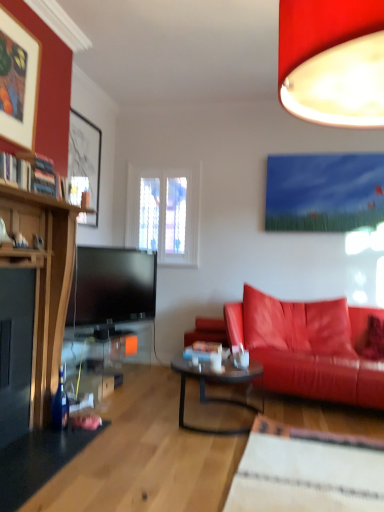
Question: From a real-world perspective, is matte red lampshade at upper right physically below shiny leather couch at right?

Choices:
 (A) yes
 (B) no

Answer: (B)

Question: Is shiny leather couch at right located within matte red lampshade at upper right?

Choices:
 (A) yes
 (B) no

Answer: (B)

Question: Are matte red lampshade at upper right and shiny leather couch at right far apart?

Choices:
 (A) yes
 (B) no

Answer: (A)

Question: Is shiny leather couch at right at the back of matte red lampshade at upper right?

Choices:
 (A) yes
 (B) no

Answer: (B)

Question: Is matte red lampshade at upper right smaller than shiny leather couch at right?

Choices:
 (A) yes
 (B) no

Answer: (A)

Question: Can you confirm if matte red lampshade at upper right is shorter than shiny leather couch at right?

Choices:
 (A) no
 (B) yes

Answer: (B)

Question: Considering the relative sizes of matte red lampshade at upper right and matte black picture frame at upper left, which is counted as the first picture frame, starting from the back, in the image provided, is matte red lampshade at upper right wider than matte black picture frame at upper left, which is counted as the first picture frame, starting from the back,?

Choices:
 (A) yes
 (B) no

Answer: (A)

Question: Is matte red lampshade at upper right to the left of matte black picture frame at upper left, marked as the second picture frame in a front-to-back arrangement, from the viewer's perspective?

Choices:
 (A) no
 (B) yes

Answer: (A)

Question: Does matte red lampshade at upper right have a lesser height compared to matte black picture frame at upper left, marked as the second picture frame in a front-to-back arrangement?

Choices:
 (A) yes
 (B) no

Answer: (A)

Question: From a real-world perspective, is matte red lampshade at upper right physically above matte black picture frame at upper left, which is counted as the first picture frame, starting from the back?

Choices:
 (A) yes
 (B) no

Answer: (A)

Question: Does matte red lampshade at upper right come in front of matte black picture frame at upper left, which is counted as the first picture frame, starting from the back?

Choices:
 (A) no
 (B) yes

Answer: (B)

Question: Is matte red lampshade at upper right directly adjacent to matte black picture frame at upper left, marked as the second picture frame in a front-to-back arrangement?

Choices:
 (A) no
 (B) yes

Answer: (A)

Question: Considering the relative sizes of matte black picture frame at upper left, which is counted as the first picture frame, starting from the back, and translucent glass coffee table at center in the image provided, is matte black picture frame at upper left, which is counted as the first picture frame, starting from the back, shorter than translucent glass coffee table at center?

Choices:
 (A) yes
 (B) no

Answer: (B)